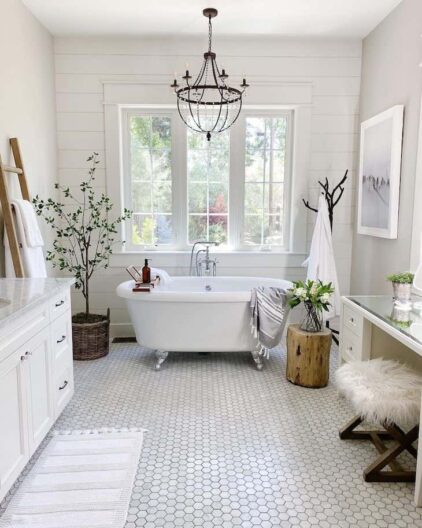
This screenshot has height=528, width=422. I want to click on white robe, so click(x=319, y=253).